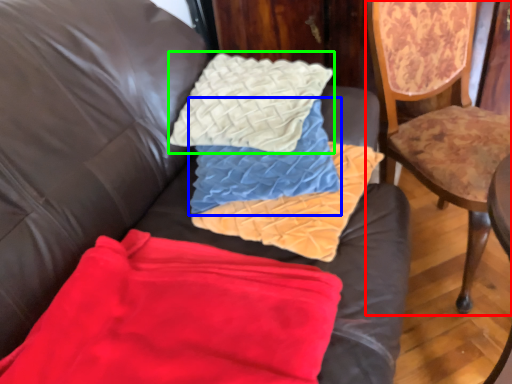
Question: Which is farther away from chair (highlighted by a red box)? pillow (highlighted by a blue box) or throw pillow (highlighted by a green box)?

Choices:
 (A) pillow
 (B) throw pillow

Answer: (A)